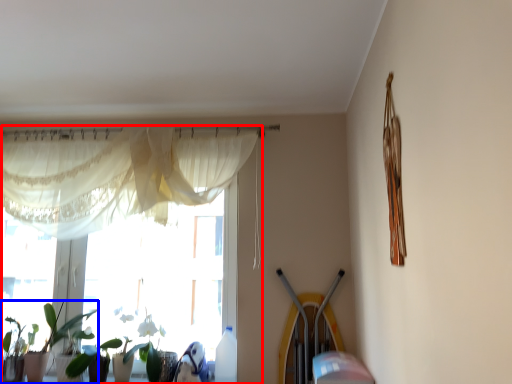
Question: Which point is closer to the camera, window (highlighted by a red box) or houseplant (highlighted by a blue box)?

Choices:
 (A) window
 (B) houseplant

Answer: (B)